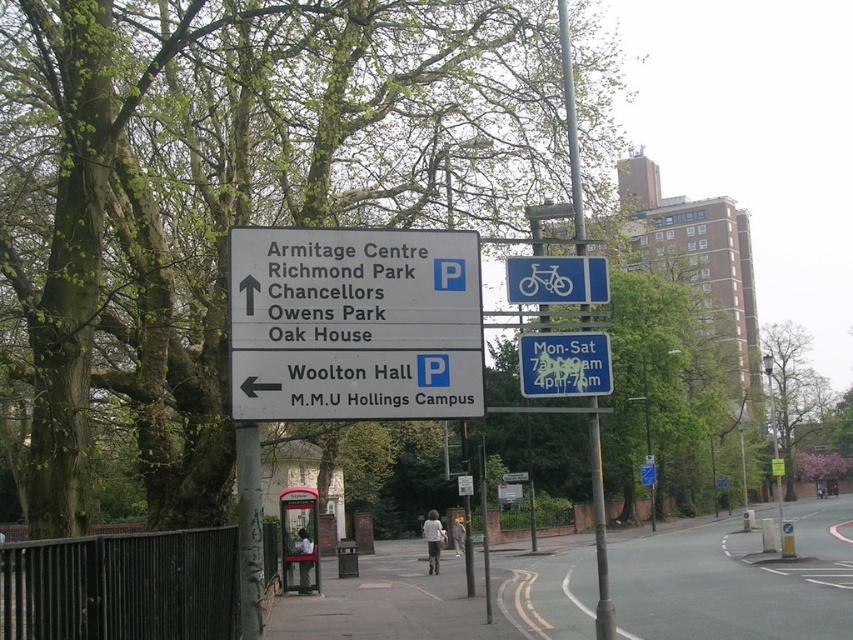
Describe the element at coordinates (599, 529) in the screenshot. This screenshot has height=640, width=853. I see `blue metallic signpost at upper center` at that location.

Is blue metallic signpost at upper center below blue plastic bicycle at upper center?

Indeed, blue metallic signpost at upper center is positioned under blue plastic bicycle at upper center.

Does point (599, 570) come closer to viewer compared to point (521, 257)?

No, (599, 570) is further to viewer.

Identify the location of blue metallic signpost at upper center. (599, 529).

Who is positioned more to the right, blue metallic signpost at upper center or blue plastic sign at upper center?

From the viewer's perspective, blue metallic signpost at upper center appears more on the right side.

Based on the photo, is blue metallic signpost at upper center positioned before blue plastic sign at upper center?

No, it is not.

Between point (596, 445) and point (550, 378), which one is positioned behind?

Positioned behind is point (596, 445).

Identify the location of blue metallic signpost at upper center. pos(599,529).

Consider the image. How distant is gray asphalt road at lower center from blue plastic sign at upper center?

The distance of gray asphalt road at lower center from blue plastic sign at upper center is 59.66 feet.

You are a GUI agent. You are given a task and a screenshot of the screen. Output one action in this format:
    pyautogui.click(x=<x>, y=<y>)
    Task: Click on the gray asphalt road at lower center
    This screenshot has width=853, height=640.
    Given the screenshot: What is the action you would take?
    pyautogui.click(x=737, y=580)

Find the location of a particular element. This screenshot has width=853, height=640. gray asphalt road at lower center is located at coordinates (737, 580).

Find the location of a particular element. The height and width of the screenshot is (640, 853). gray asphalt road at lower center is located at coordinates (737, 580).